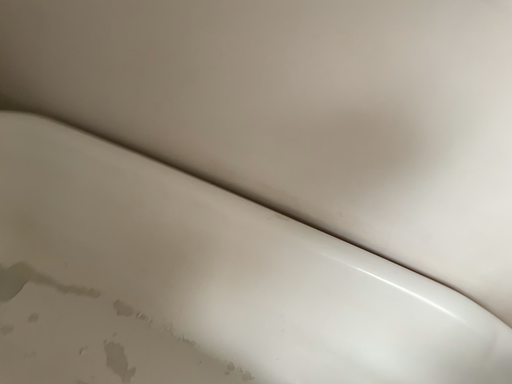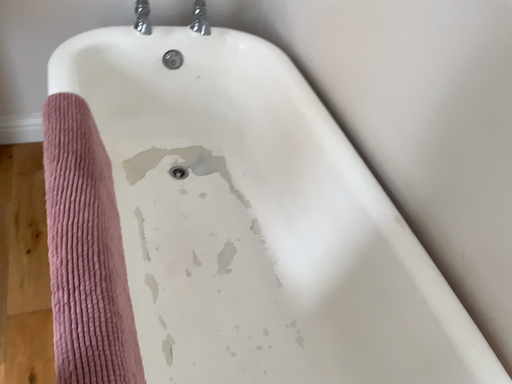
Question: Which way did the camera rotate in the video?

Choices:
 (A) rotated right
 (B) rotated left

Answer: (B)